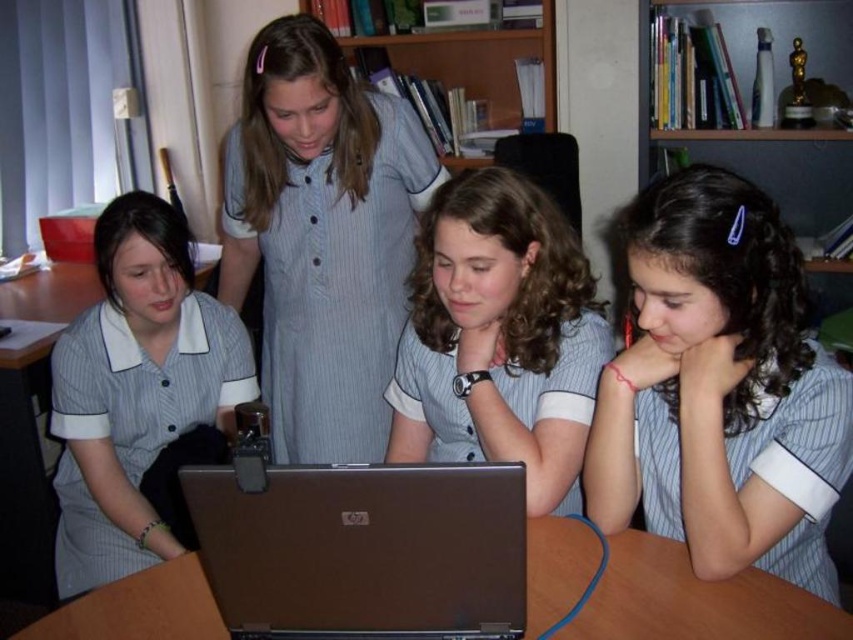
Is striped fabric dress at center above matte gray uniform at left?

Correct, striped fabric dress at center is located above matte gray uniform at left.

Is point (410, 156) less distant than point (64, 573)?

No.

Identify the location of striped fabric dress at center. The width and height of the screenshot is (853, 640). (322, 237).

This screenshot has width=853, height=640. What do you see at coordinates (363, 548) in the screenshot? I see `silver metallic laptop at center` at bounding box center [363, 548].

Which is more to the left, silver metallic laptop at center or matte gray uniform at left?

matte gray uniform at left

Who is more distant from viewer, (380, 516) or (138, 564)?

Positioned behind is point (138, 564).

This screenshot has width=853, height=640. Identify the location of silver metallic laptop at center. (363, 548).

Is silver metallic laptop at center smaller than wooden bookshelf at upper center?

Indeed, silver metallic laptop at center has a smaller size compared to wooden bookshelf at upper center.

Does silver metallic laptop at center appear on the right side of wooden bookshelf at upper center?

In fact, silver metallic laptop at center is to the left of wooden bookshelf at upper center.

Does point (434, 589) come behind point (434, 38)?

No, it is in front of (434, 38).

Identify the location of silver metallic laptop at center. The width and height of the screenshot is (853, 640). (363, 548).